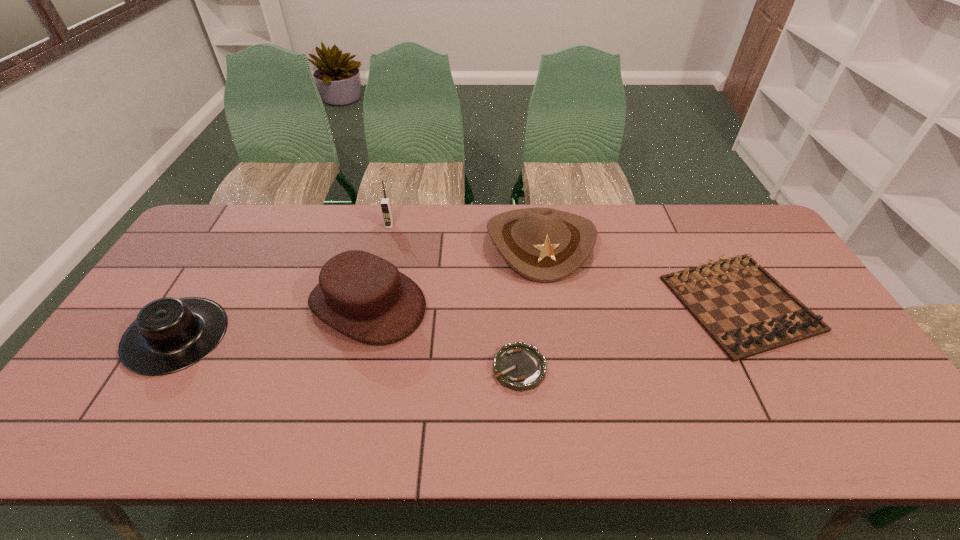
The image size is (960, 540). I want to click on the tallest object, so tap(385, 203).

Locate an element on the screen. This screenshot has width=960, height=540. cowboy hat is located at coordinates (545, 245).

Find the location of a particular element. the taller dress hat is located at coordinates (359, 294).

Identify the location of the leftmost object. The image size is (960, 540). (169, 334).

Where is `the left dress hat`? the left dress hat is located at coordinates (169, 334).

Image resolution: width=960 pixels, height=540 pixels. What are the coordinates of `chessboard` in the screenshot? It's located at (744, 309).

In order to click on the fifth tallest object in this screenshot , I will do `click(744, 309)`.

Find the location of `ashtray`. ashtray is located at coordinates (519, 366).

The height and width of the screenshot is (540, 960). Find the location of `free space located on the front-facing side of the tallest object`. free space located on the front-facing side of the tallest object is located at coordinates (381, 259).

Find the location of a particular element. The width and height of the screenshot is (960, 540). free spot located with a star on the front of the cowboy hat is located at coordinates (551, 320).